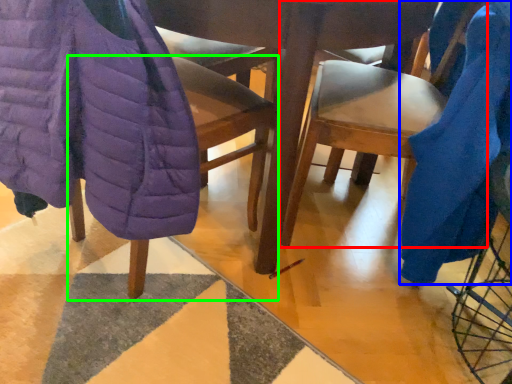
Question: Estimate the real-world distances between objects in this image. Which object is farther from chair (highlighted by a red box), blanket (highlighted by a blue box) or chair (highlighted by a green box)?

Choices:
 (A) blanket
 (B) chair

Answer: (B)